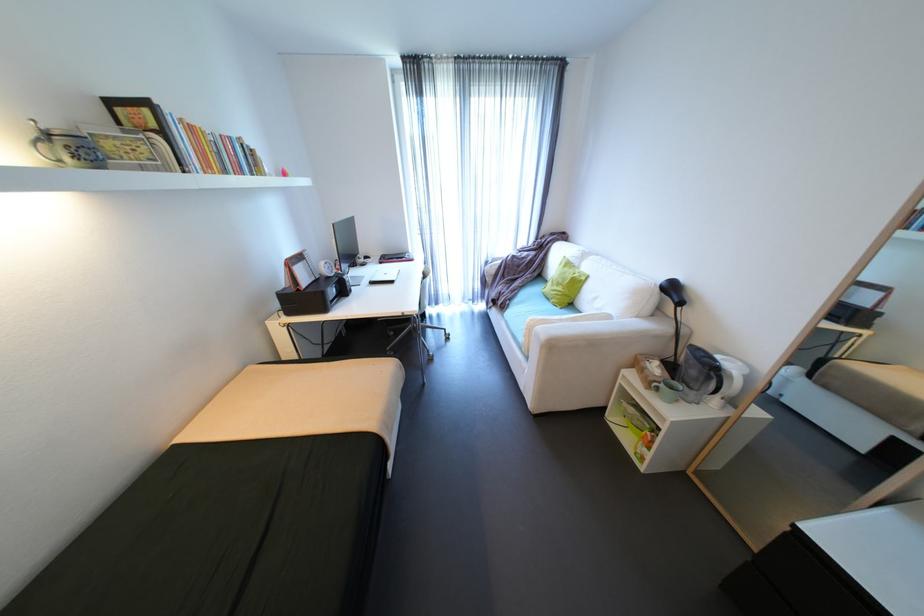
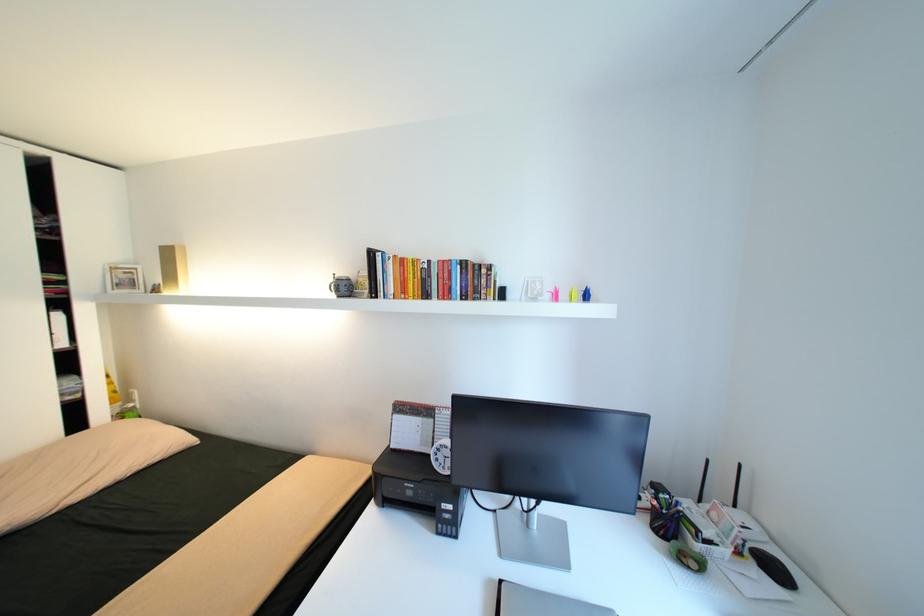
Locate, in the second image, the point that corresponds to pixel 227 136 in the first image.

(445, 262)